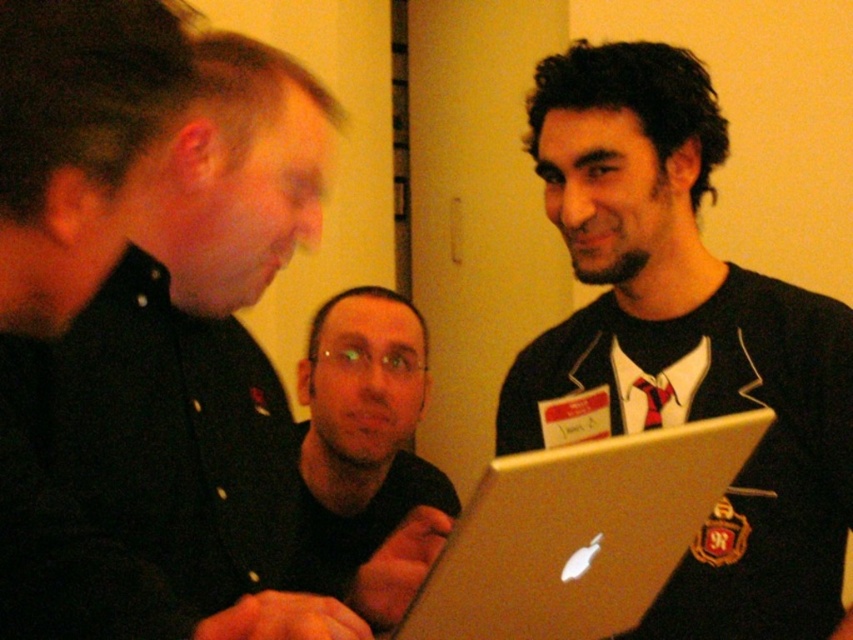
Is silver metallic laptop at center above matte black shirt at center?

No.

Is point (485, 518) farther from camera compared to point (358, 515)?

No, (485, 518) is in front of (358, 515).

Locate an element on the screen. The height and width of the screenshot is (640, 853). silver metallic laptop at center is located at coordinates (579, 532).

Is silver metallic laptop at center-right shorter than silver metallic laptop at center?

In fact, silver metallic laptop at center-right may be taller than silver metallic laptop at center.

Between silver metallic laptop at center-right and silver metallic laptop at center, which one appears on the left side from the viewer's perspective?

From the viewer's perspective, silver metallic laptop at center appears more on the left side.

At what (x,y) coordinates should I click in order to perform the action: click on silver metallic laptop at center-right. Please return your answer as a coordinate pair (x, y). Looking at the image, I should click on (686, 342).

Where is `silver metallic laptop at center-right`? The width and height of the screenshot is (853, 640). silver metallic laptop at center-right is located at coordinates (686, 342).

Who is taller, silver metallic laptop at center-right or matte black shirt at center?

Standing taller between the two is silver metallic laptop at center-right.

How far apart are silver metallic laptop at center-right and matte black shirt at center?

43.52 centimeters

Which is in front, point (593, 253) or point (372, 390)?

Positioned in front is point (593, 253).

Locate an element on the screen. silver metallic laptop at center-right is located at coordinates (686, 342).